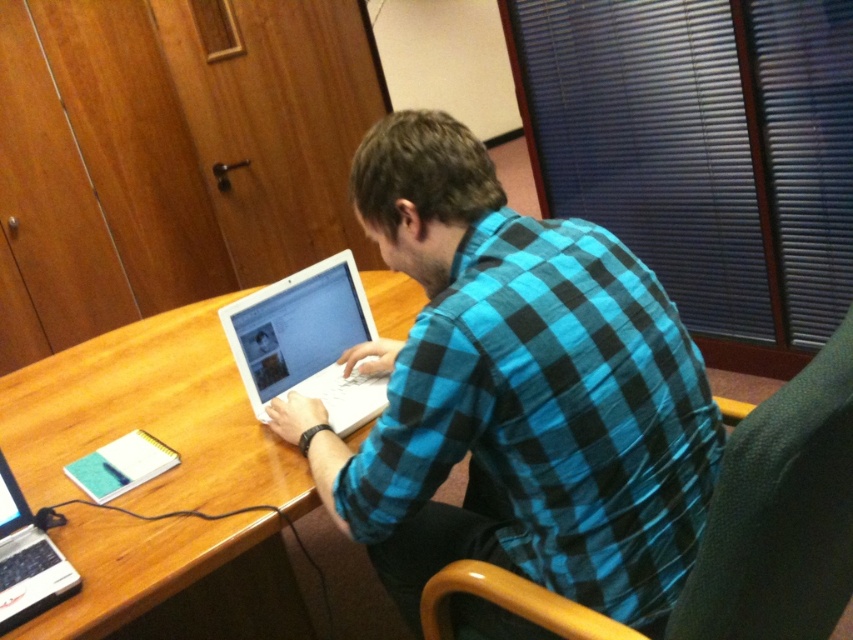
Is point (549, 512) positioned behind point (27, 586)?

No, it is in front of (27, 586).

Can you confirm if blue checkered shirt at center is positioned above silver metallic laptop at lower left?

Indeed, blue checkered shirt at center is positioned over silver metallic laptop at lower left.

Image resolution: width=853 pixels, height=640 pixels. I want to click on blue checkered shirt at center, so click(x=515, y=394).

Is blue checkered shirt at center taller than wooden table at center?

Correct, blue checkered shirt at center is much taller as wooden table at center.

What do you see at coordinates (515, 394) in the screenshot?
I see `blue checkered shirt at center` at bounding box center [515, 394].

Is point (402, 403) positioned after point (10, 381)?

That is False.

At what (x,y) coordinates should I click in order to perform the action: click on blue checkered shirt at center. Please return your answer as a coordinate pair (x, y). This screenshot has height=640, width=853. Looking at the image, I should click on (515, 394).

Consider the image. Who is higher up, wooden table at center or white glossy laptop at center?

white glossy laptop at center is above.

The width and height of the screenshot is (853, 640). What do you see at coordinates (149, 417) in the screenshot?
I see `wooden table at center` at bounding box center [149, 417].

I want to click on wooden table at center, so click(149, 417).